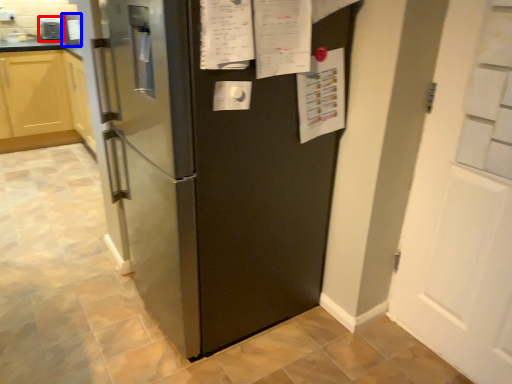
Question: Which of the following is the closest to the observer, appliance (highlighted by a red box) or appliance (highlighted by a blue box)?

Choices:
 (A) appliance
 (B) appliance

Answer: (B)